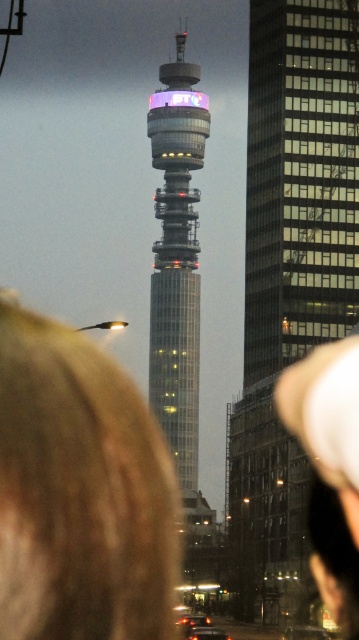
You are standing in front of the BT Tower and see a person with blonde hair at lower left. If you want to take a photo of the BT Tower with the person in the frame, where should you position the camera relative to the person?

Position the camera to the right of the person with blonde hair at lower left since the person is located at point (x=78, y=492), which is on the left side of the frame.

You are a photographer trying to capture the glassy metallic tower at center in your shot. You notice the blonde hair at lower left is partially blocking the view. Can you estimate which object takes up more space in the current frame?

The glassy metallic tower at center occupies more space in the frame than the blonde hair at lower left, so the tower is more prominent in the current composition.

You are standing at the center of the image and want to locate the glassy steel tower at center. According to the coordinates provided, in which direction should you look to find it?

The glassy steel tower at center is located at coordinates point (290, 276). Since you are at the center, looking towards the upper part of the image will direct you to the tower as the y coordinate 0.808 is higher than 0.5 which is the center point.